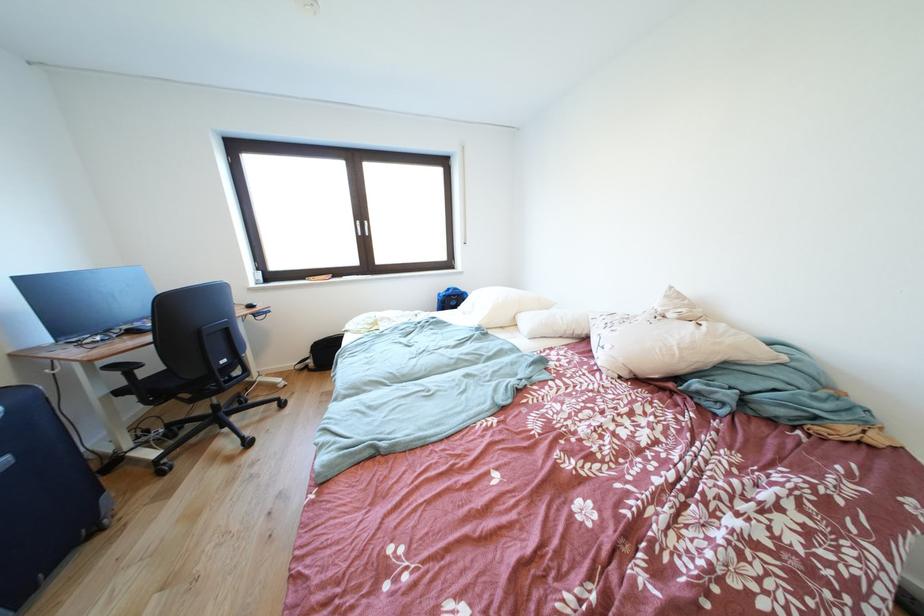
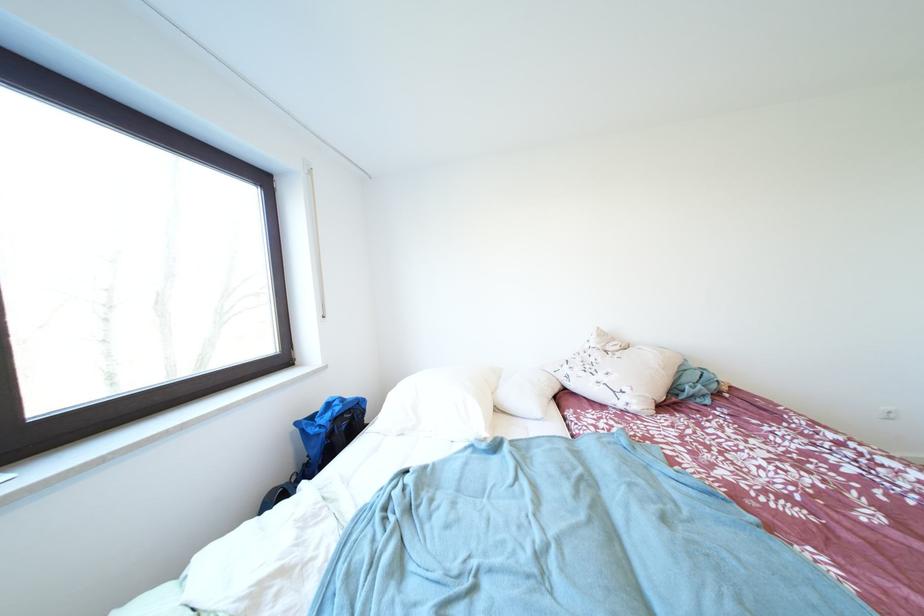
Locate, in the second image, the point that corresponds to point 679,292 in the first image.

(606, 333)